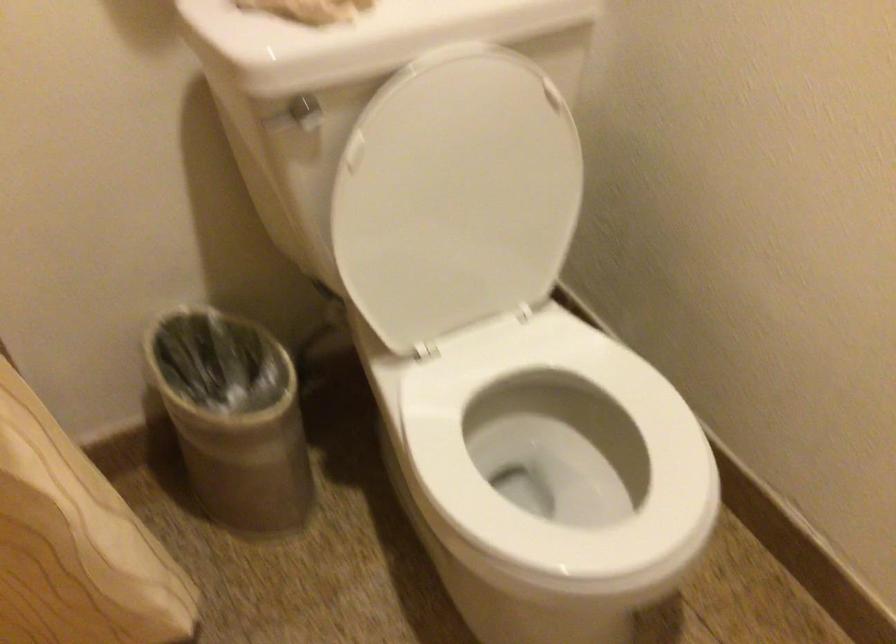
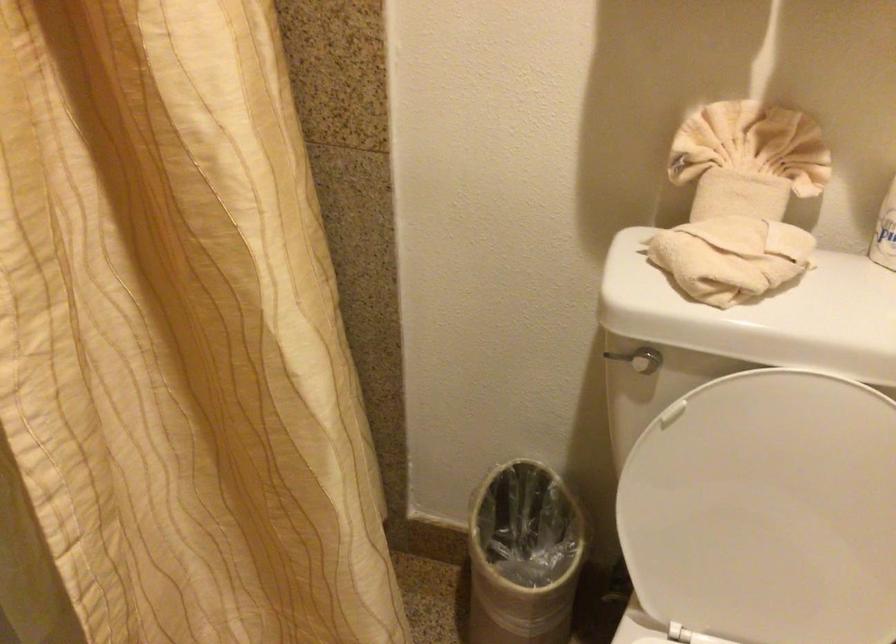
In the second image, find the point that corresponds to the point at 222,406 in the first image.

(522, 556)